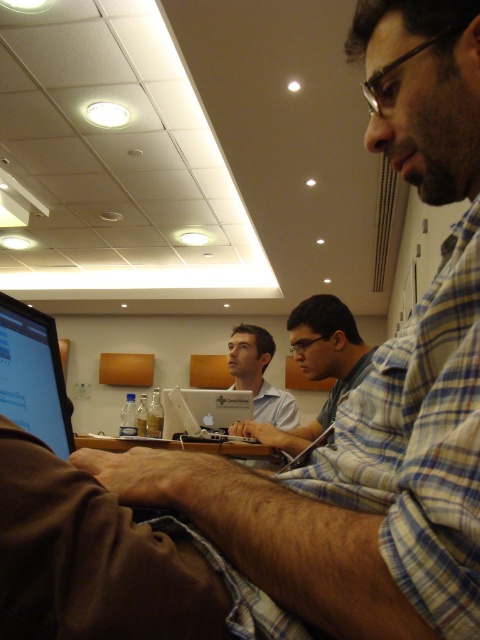
The width and height of the screenshot is (480, 640). Describe the element at coordinates (33, 376) in the screenshot. I see `matte black laptop at left` at that location.

Does matte black laptop at left have a smaller size compared to light blue shirt at center?

Yes, matte black laptop at left is smaller than light blue shirt at center.

Between point (33, 365) and point (336, 317), which one is positioned behind?

Positioned behind is point (336, 317).

Locate an element on the screen. This screenshot has width=480, height=640. matte black laptop at left is located at coordinates (33, 376).

Is matte white laptop at center closer to the viewer compared to silver metallic laptop at center?

That is False.

Looking at this image, which is above, matte white laptop at center or silver metallic laptop at center?

matte white laptop at center

Who is more distant from viewer, (239, 378) or (166, 435)?

Positioned behind is point (239, 378).

Find the location of a particular element. matte white laptop at center is located at coordinates (259, 376).

In the scene shown: Who is shorter, matte black laptop at left or silver metallic laptop at center?

silver metallic laptop at center

Locate an element on the screen. The width and height of the screenshot is (480, 640). matte black laptop at left is located at coordinates (33, 376).

The height and width of the screenshot is (640, 480). Describe the element at coordinates (33, 376) in the screenshot. I see `matte black laptop at left` at that location.

In order to click on matte black laptop at left in this screenshot , I will do `click(33, 376)`.